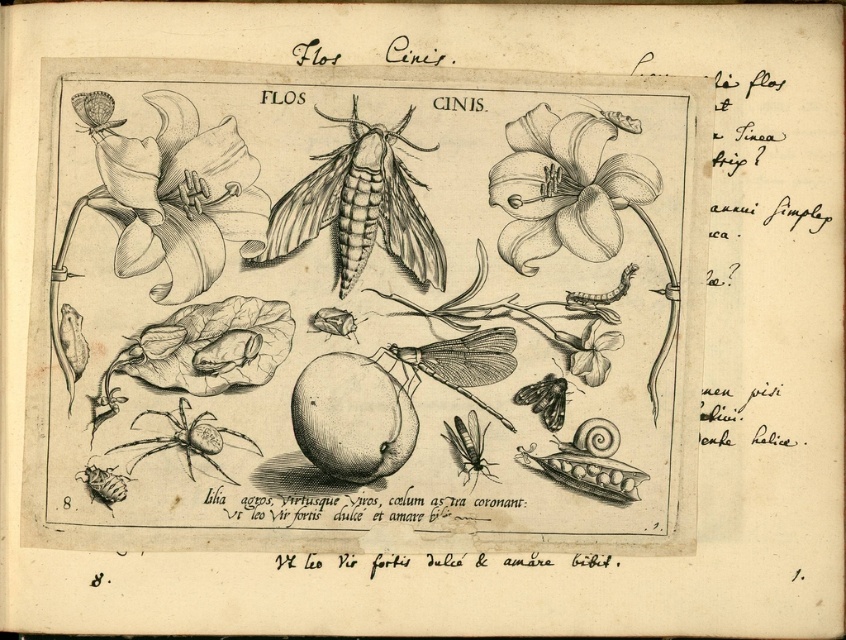
Question: Which point is closer to the camera?

Choices:
 (A) (398, 349)
 (B) (592, 337)

Answer: (A)

Question: Can you confirm if smooth white lily at upper right is thinner than translucent winged insect at center?

Choices:
 (A) no
 (B) yes

Answer: (A)

Question: Which of the following is the farthest from the observer?

Choices:
 (A) smooth white lily at upper right
 (B) translucent winged insect at center
 (C) satin-like snail at lower right
 (D) translucent yellowish-green moth at center-right

Answer: (D)

Question: Observing the image, what is the correct spatial positioning of translucent paper moth at center in reference to satin-like snail at lower right?

Choices:
 (A) above
 (B) below

Answer: (A)

Question: Which of the following is the closest to the observer?

Choices:
 (A) (545, 163)
 (B) (416, 380)
 (C) (209, 385)
 (D) (594, 465)

Answer: (C)

Question: Does translucent paper moth at center appear on the left side of satin-like snail at lower right?

Choices:
 (A) no
 (B) yes

Answer: (B)